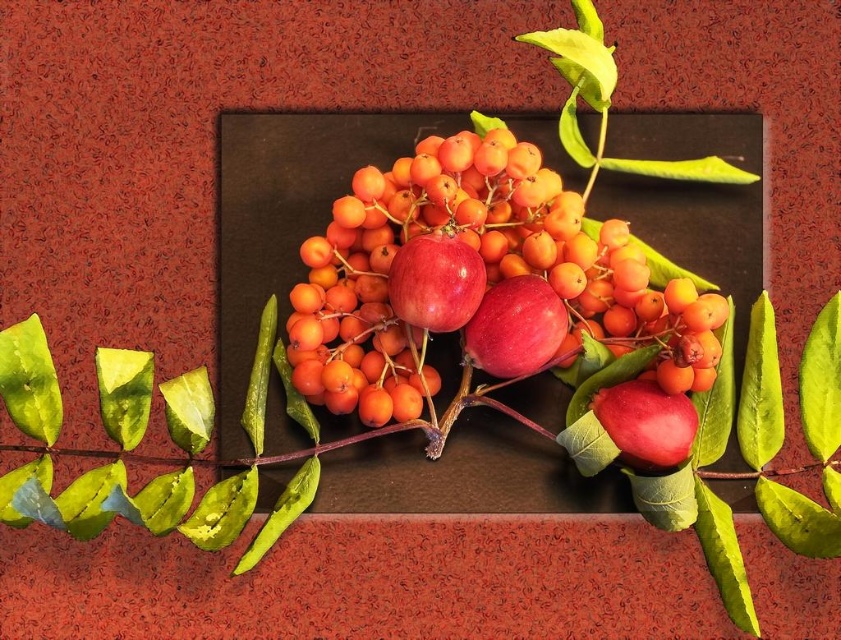
Question: Is glossy red apples at center wider than glossy red apple at center?

Choices:
 (A) yes
 (B) no

Answer: (A)

Question: Can you confirm if glossy red apples at center is positioned above glossy red apple at center?

Choices:
 (A) yes
 (B) no

Answer: (A)

Question: Which of the following is the farthest from the observer?

Choices:
 (A) glossy red apple at center
 (B) glossy red apples at center

Answer: (A)

Question: Is glossy red apples at center above glossy red apple at center?

Choices:
 (A) no
 (B) yes

Answer: (B)